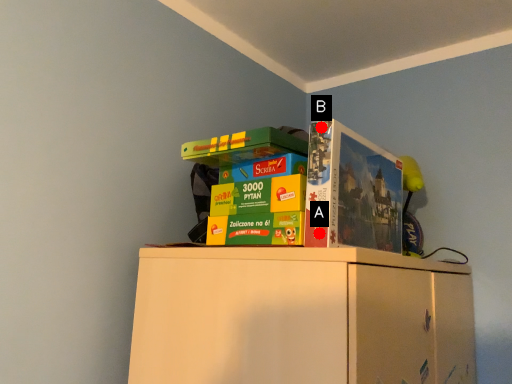
Question: Two points are circled on the image, labeled by A and B beside each circle. Which point is closer to the camera taking this photo?

Choices:
 (A) A is closer
 (B) B is closer

Answer: (A)